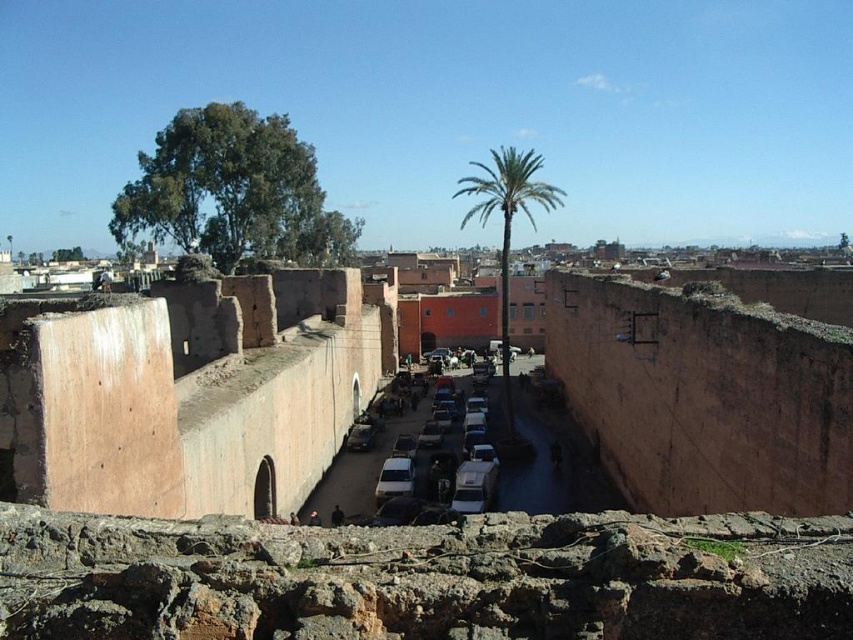
Can you confirm if brown rough stone wall at center is positioned to the left of matte white van at center?

Incorrect, brown rough stone wall at center is not on the left side of matte white van at center.

Is brown rough stone wall at center behind matte white van at center?

That is False.

Who is more distant from viewer, (546, 314) or (364, 444)?

The point (546, 314) is more distant.

Where is `brown rough stone wall at center`? This screenshot has height=640, width=853. brown rough stone wall at center is located at coordinates (703, 396).

Is rustic stone wall at left below green leafy palm at center?

Yes, rustic stone wall at left is below green leafy palm at center.

What do you see at coordinates (186, 392) in the screenshot? I see `rustic stone wall at left` at bounding box center [186, 392].

Locate an element on the screen. rustic stone wall at left is located at coordinates (186, 392).

Identify the location of white matte van at center. (442, 458).

Which is in front, point (438, 440) or point (364, 429)?

Point (438, 440) is in front.

Describe the element at coordinates (442, 458) in the screenshot. I see `white matte van at center` at that location.

Identify the location of white matte van at center. This screenshot has width=853, height=640. (442, 458).